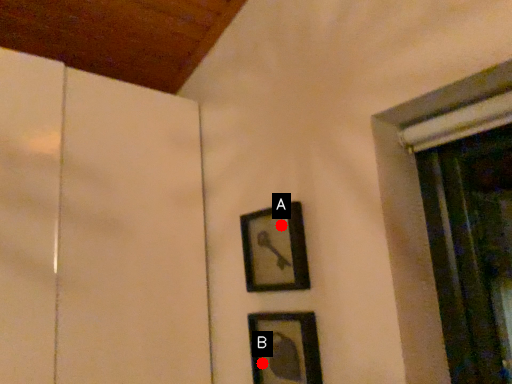
Question: Two points are circled on the image, labeled by A and B beside each circle. Which point appears closest to the camera in this image?

Choices:
 (A) A is closer
 (B) B is closer

Answer: (A)